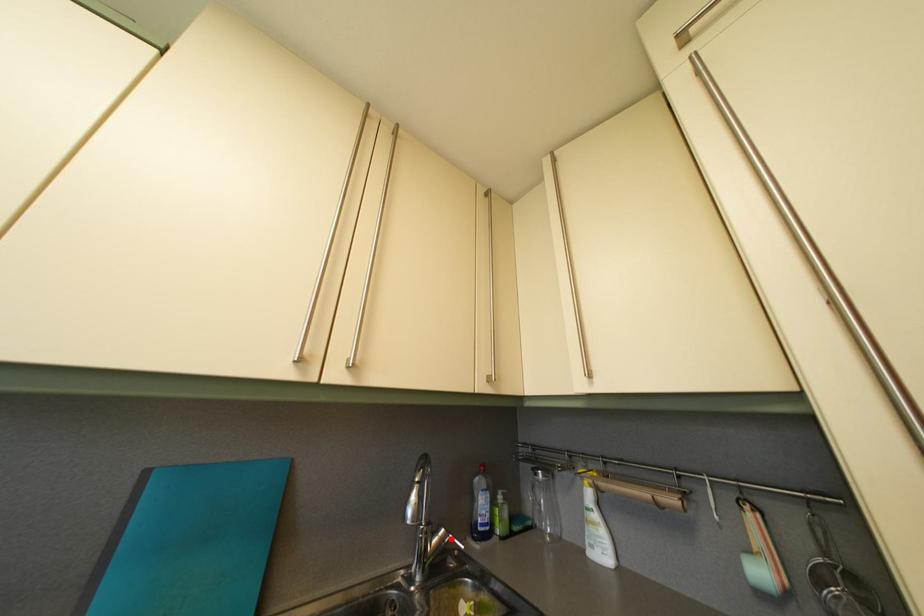
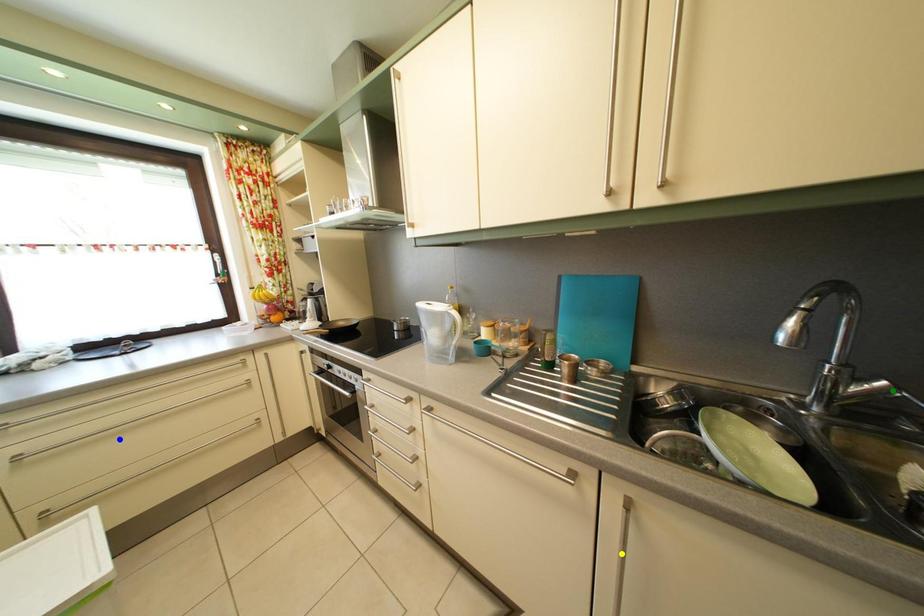
Question: I am providing you with two images of the same scene from different viewpoints. A red point is marked on the first image. You are given multiple points on the second image. Can you choose the point in image 2 that corresponds to the point in image 1?

Choices:
 (A) yellow point
 (B) green point
 (C) blue point

Answer: (B)